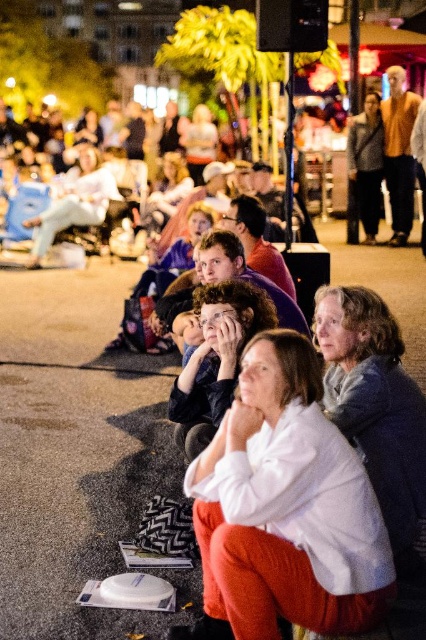
You are standing in the crowd watching the performance. There are two points in the scene, one at coordinate point (218, 611) and another at point (356, 296). Which point is closer to you?

Point (218, 611) is closer to the viewer than point (356, 296).

Consider the image. You are standing at the point labeled as point (x=287, y=506) and want to move towards the white cotton shirt at center. Is the white cotton shirt at center located to your left or right side?

The white cotton shirt at center is located at the point (x=287, y=506), so you are already at the same location as the white cotton shirt at center.

You are standing in the nighttime scene and want to find the white cotton shirt at center. According to the coordinates provided, where should you look first?

You should look at point 0.791 on the x axis and 0.674 on the y axis to find the white cotton shirt at center.